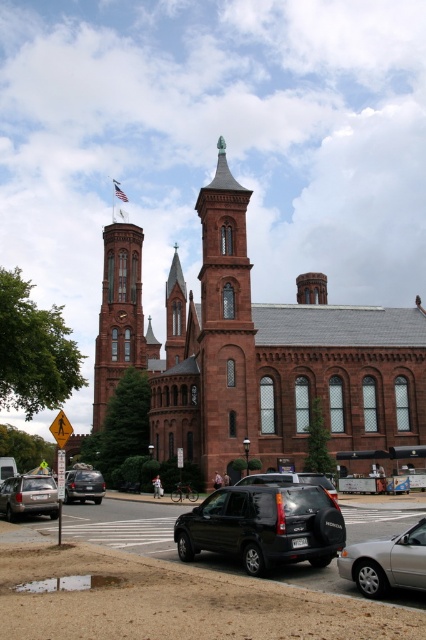
Image resolution: width=426 pixels, height=640 pixels. Identify the location of matte black suv at lower left. (83, 484).

Is matte black suv at lower left shorter than yellow reflective plastic pedestrian crossing sign at lower left?

Yes, matte black suv at lower left is shorter than yellow reflective plastic pedestrian crossing sign at lower left.

Where is `matte black suv at lower left`? matte black suv at lower left is located at coordinates (83, 484).

Image resolution: width=426 pixels, height=640 pixels. Find the location of `matte black suv at lower left`. matte black suv at lower left is located at coordinates (83, 484).

Does red brick church at center appear under silver metallic sedan at lower right?

Incorrect, red brick church at center is not positioned below silver metallic sedan at lower right.

Looking at this image, can you confirm if red brick church at center is positioned above silver metallic sedan at lower right?

Yes.

Between point (331, 416) and point (382, 577), which one is positioned in front?

Point (382, 577) is in front.

Where is `red brick church at center`? This screenshot has height=640, width=426. red brick church at center is located at coordinates (255, 353).

Can you confirm if silver metallic sedan at lower right is wider than matte silver suv at lower left?

Incorrect, silver metallic sedan at lower right's width does not surpass matte silver suv at lower left's.

Consider the image. Between silver metallic sedan at lower right and matte silver suv at lower left, which one is positioned lower?

matte silver suv at lower left is below.

Between point (359, 548) and point (22, 483), which one is positioned in front?

Positioned in front is point (359, 548).

Find the location of a particular element. This screenshot has height=640, width=426. silver metallic sedan at lower right is located at coordinates pyautogui.click(x=386, y=563).